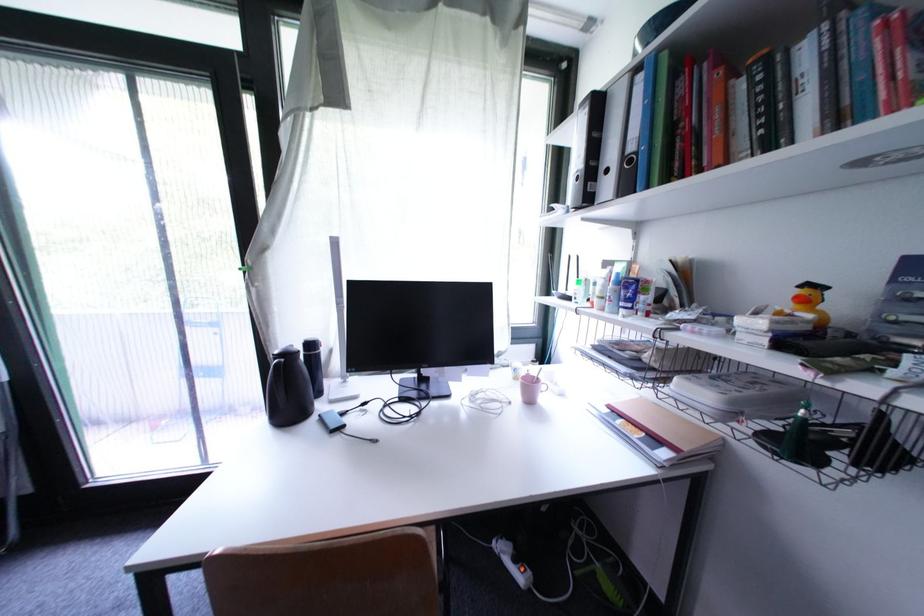
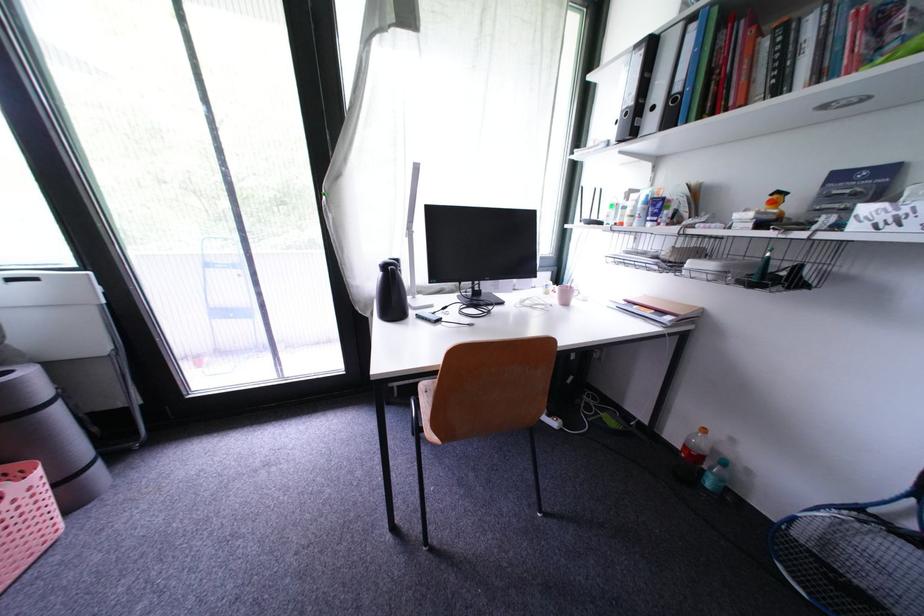
In the second image, find the point that corresponds to [552,391] in the first image.

(584, 296)